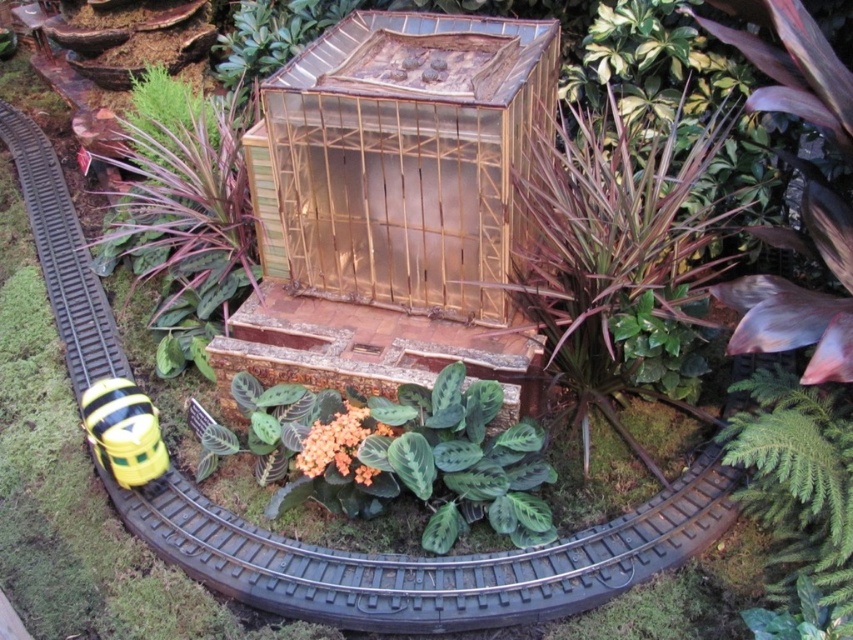
You are a model train enthusiast examining the miniature garden scene. You notice the transparent bamboo cage at center and the green leafy fern at lower right. From your viewpoint, which object is closer to you?

The transparent bamboo cage at center is closer to you because the green leafy fern at lower right is behind it.

You are a model train enthusiast who wants to place a new toy that is 1.5 meters long between the green leafy fern at lower right and the yellow matte toy at lower left. Will the toy fit in the space between them?

The distance between the green leafy fern at lower right and the yellow matte toy at lower left is 1.43 meters. Since the new toy is 1.5 meters long, it will not fit in the space between them.